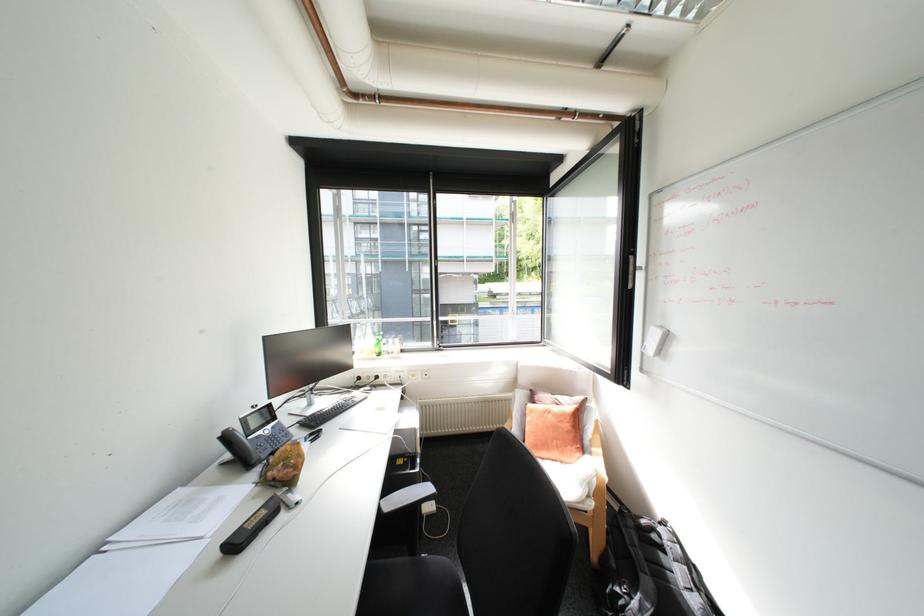
You are a GUI agent. You are given a task and a screenshot of the screen. Output one action in this format:
    pyautogui.click(x=<x>, y=<y>)
    Task: Click on the chair sitting surface
    Image resolution: width=924 pixels, height=616 pixels.
    Given the screenshot: What is the action you would take?
    pyautogui.click(x=427, y=586)